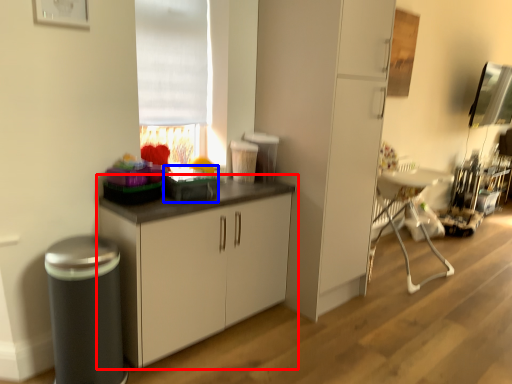
Question: Which object appears farthest to the camera in this image, cabinetry (highlighted by a red box) or appliance (highlighted by a blue box)?

Choices:
 (A) cabinetry
 (B) appliance

Answer: (B)